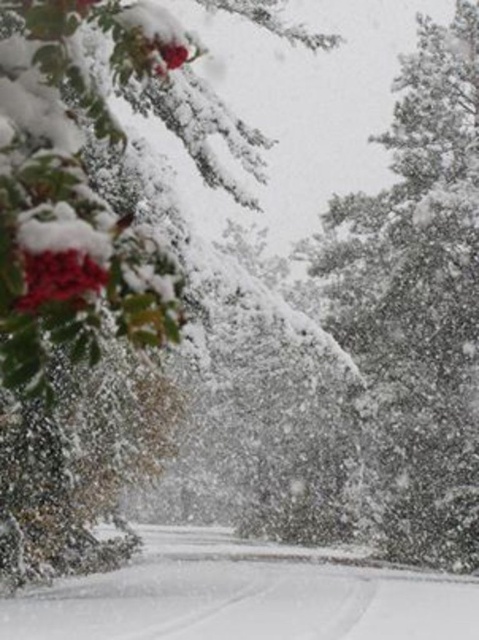
You are standing in the winter scene and want to take a closer look at the white fluffy snow at upper right and the white fluffy snow at center. Which one would you need to walk towards to get closer?

You would need to walk towards the white fluffy snow at center because the white fluffy snow at upper right is already closer to you, so moving towards it wouldn